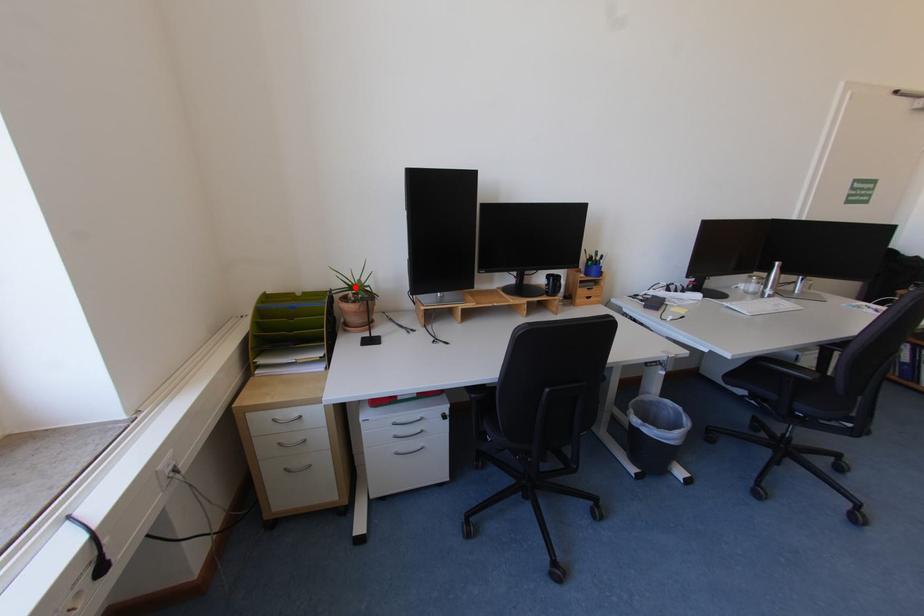
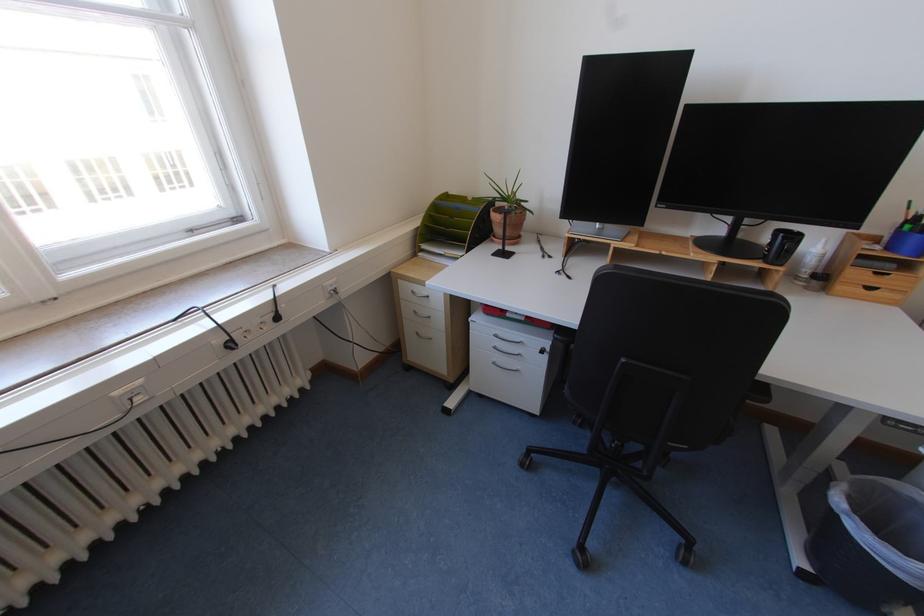
Locate, in the second image, the point that corresponds to the highlighted location in the first image.

(506, 197)